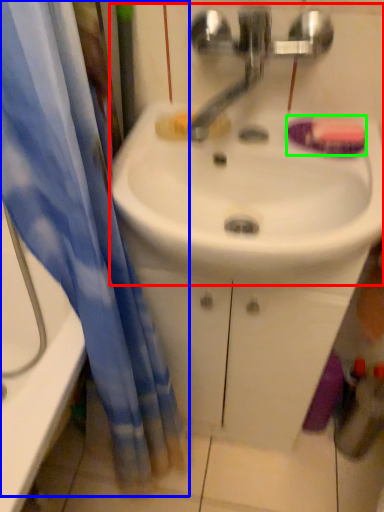
Question: Which object is positioned farthest from sink (highlighted by a red box)? Select from curtain (highlighted by a blue box) and soap (highlighted by a green box).

Choices:
 (A) curtain
 (B) soap

Answer: (A)